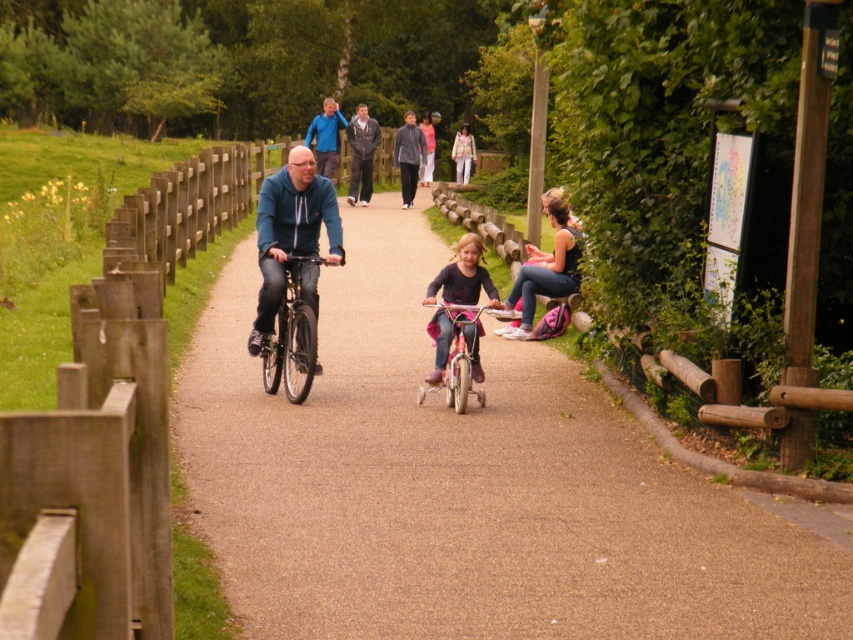
You are standing on the paved path and want to walk to a point that is closer to you. Which point should you choose between point [711,579] and point [289,177]?

Point [711,579] is closer to the viewer than point [289,177], so you should choose point [711,579].

From the picture: You are standing on the brown gravel path at center and want to wave to the person wearing the matte blue jacket at center. In which direction should you turn to face them?

The brown gravel path at center is positioned on the right side of matte blue jacket at center, so you should turn to your left to face the matte blue jacket at center.

You are a pedestrian walking along the path and see the matte pink bicycle at center and the blue fabric jacket at upper center. Which object is higher up in the image?

The blue fabric jacket at upper center is higher up in the image than the matte pink bicycle at center.